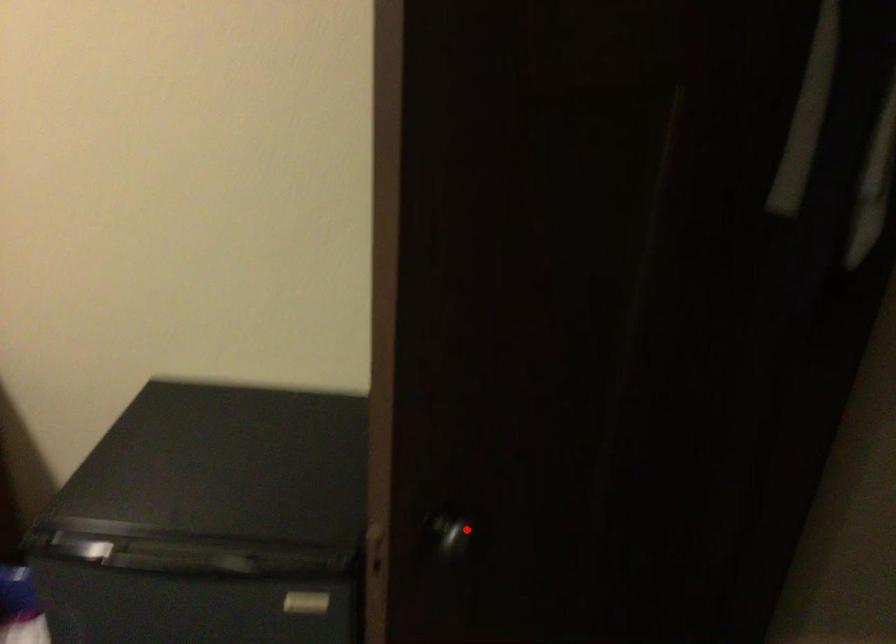
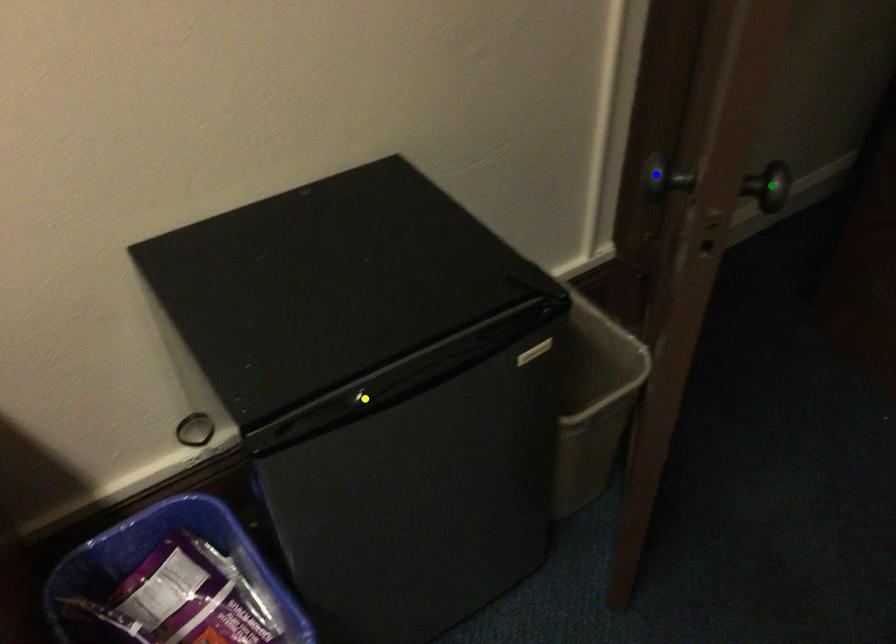
Question: I am providing you with two images of the same scene from different viewpoints. A red point is marked on the first image. You are given multiple points on the second image. Which point in image 2 is actually the same real-world point as the red point in image 1?

Choices:
 (A) green point
 (B) yellow point
 (C) blue point

Answer: (A)